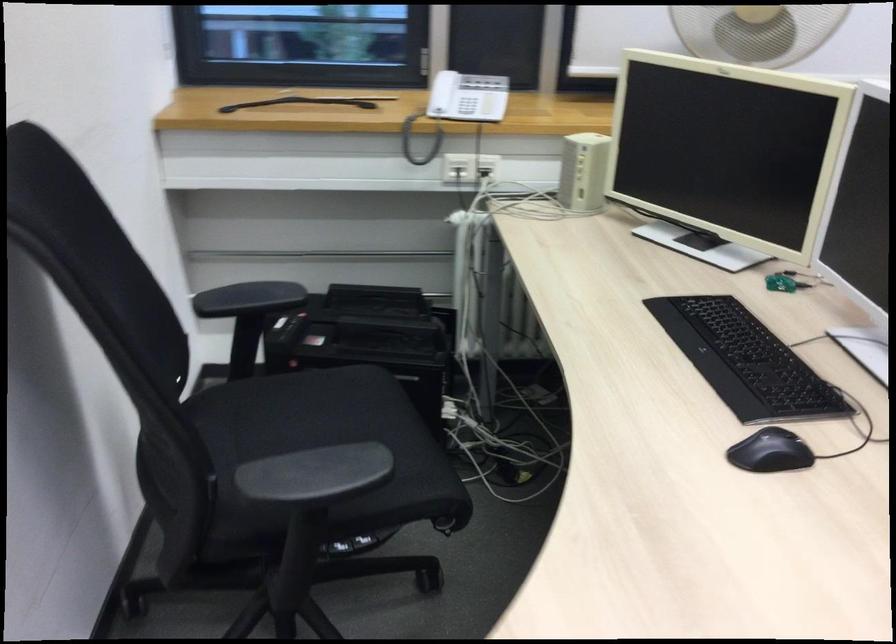
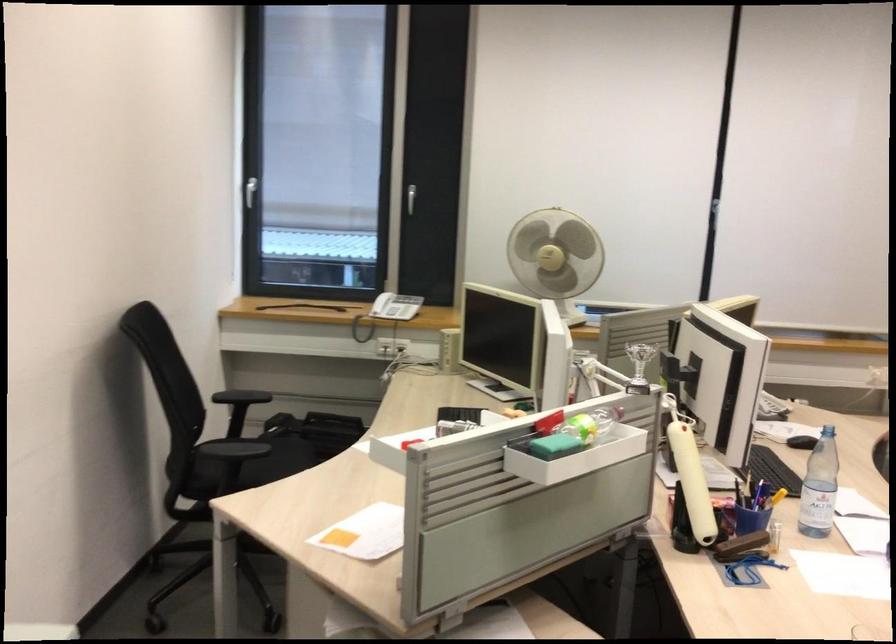
Question: I am providing you with two images of the same scene from different viewpoints. After the viewpoint changes to image2, which objects are now occluded?

Choices:
 (A) cup holder
 (B) telephone handset
 (C) black chair sitting surface
 (D) small silver trophy

Answer: (C)